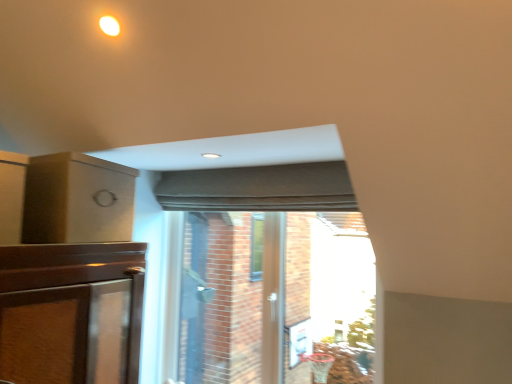
Question: In the image, is matte gray curtain at center on the left side or the right side of matte brown box at upper left?

Choices:
 (A) left
 (B) right

Answer: (B)

Question: Is matte gray curtain at center in front of or behind matte brown box at upper left in the image?

Choices:
 (A) behind
 (B) front

Answer: (A)

Question: Based on their relative distances, which object is farther from the transparent glass door at center?

Choices:
 (A) matte brown box at upper left
 (B) matte gray curtain at center

Answer: (A)

Question: Based on their relative distances, which object is farther from the transparent glass door at center?

Choices:
 (A) matte gray curtain at center
 (B) matte brown box at upper left

Answer: (B)